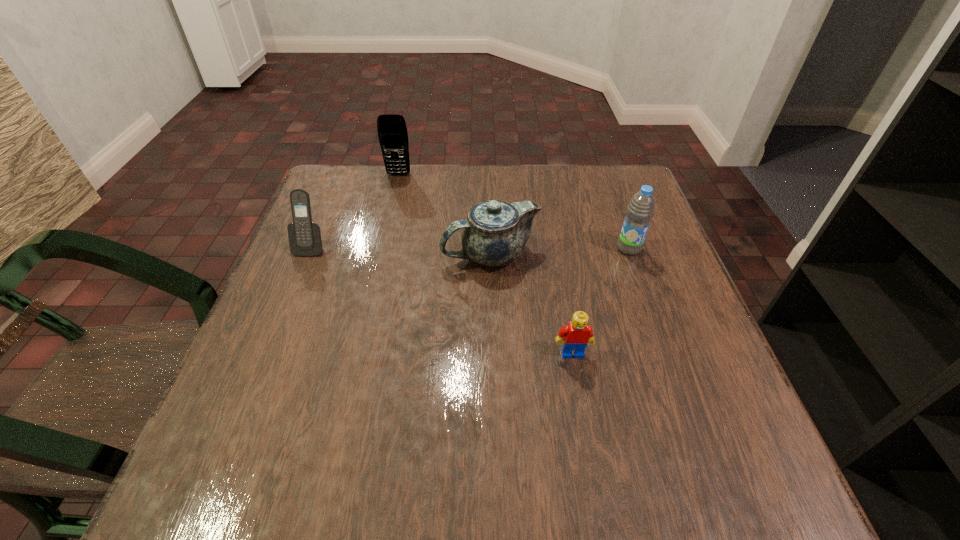
Find the location of `free point located from the spout of the chinaware`. free point located from the spout of the chinaware is located at coordinates (302, 254).

Where is `free location located from the spout of the chinaware`? This screenshot has width=960, height=540. free location located from the spout of the chinaware is located at coordinates [393, 254].

Locate an element on the screen. Image resolution: width=960 pixels, height=540 pixels. vacant point located 0.310m from the spout of the chinaware is located at coordinates (302, 254).

The height and width of the screenshot is (540, 960). I want to click on blank area located on the front-facing side of the nearer cellular telephone, so click(x=238, y=423).

You are a GUI agent. You are given a task and a screenshot of the screen. Output one action in this format:
    pyautogui.click(x=<x>, y=<y>)
    Task: Click on the vacant space positioned on the face of the nearest object
    
    Given the screenshot: What is the action you would take?
    pyautogui.click(x=586, y=428)

At what (x,y) coordinates should I click in order to perform the action: click on object located at the far edge. Please return your answer as a coordinate pair (x, y). The image size is (960, 540). Looking at the image, I should click on (392, 132).

Image resolution: width=960 pixels, height=540 pixels. I want to click on object that is at the right edge, so click(x=641, y=208).

The height and width of the screenshot is (540, 960). I want to click on object present at the far left corner, so click(x=392, y=132).

Locate an element on the screen. This screenshot has height=540, width=960. free space at the far edge is located at coordinates (429, 188).

Where is `free location at the near edge`? Image resolution: width=960 pixels, height=540 pixels. free location at the near edge is located at coordinates (435, 443).